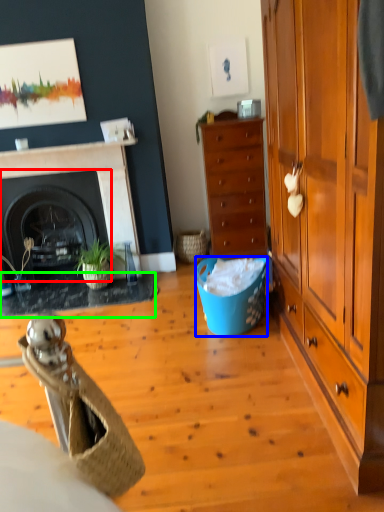
Question: Which is nearer to the fireplace (highlighted by a red box)? trash bin/can (highlighted by a blue box) or carpets (highlighted by a green box).

Choices:
 (A) trash bin/can
 (B) carpets

Answer: (B)